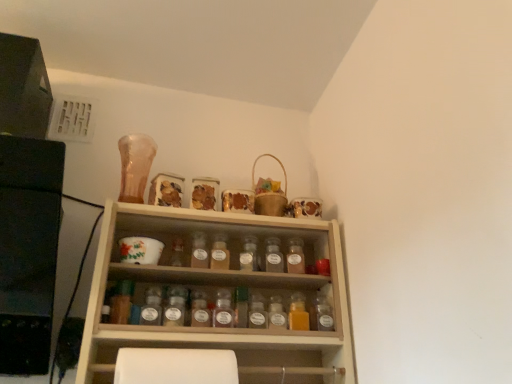
The height and width of the screenshot is (384, 512). What are the coordinates of `translucent glass spice at center, arranged as the fifth bottle when viewed from the left` in the screenshot? It's located at (223, 310).

Describe the element at coordinates (220, 253) in the screenshot. Image resolution: width=512 pixels, height=384 pixels. I see `translucent glass spice jar at center, the 4th bottle viewed from the left` at that location.

Measure the distance between translucent glass spice at center, the 6th bottle when ordered from right to left, and camera.

translucent glass spice at center, the 6th bottle when ordered from right to left, and camera are 1.22 meters apart.

Describe the element at coordinates (216, 293) in the screenshot. I see `wooden spice rack at center` at that location.

This screenshot has width=512, height=384. Describe the element at coordinates (322, 313) in the screenshot. I see `translucent amber bottle at center, which ranks as the 11th bottle in left-to-right order` at that location.

Where is `translucent glass spice at center, arranged as the fifth bottle when viewed from the left`? This screenshot has height=384, width=512. translucent glass spice at center, arranged as the fifth bottle when viewed from the left is located at coordinates (223, 310).

Consider the image. From the image's perspective, which object appears higher, translucent glass spice at center, which appears as the 3th bottle when viewed from the left, or translucent amber bottle at center, which ranks as the 11th bottle in left-to-right order?

translucent glass spice at center, which appears as the 3th bottle when viewed from the left, is shown above in the image.

From a real-world perspective, relative to translucent amber bottle at center, the first bottle from the right, is translucent glass spice at center, the ninth bottle from the right, vertically above or below?

From a real-world perspective, translucent glass spice at center, the ninth bottle from the right, is physically above translucent amber bottle at center, the first bottle from the right.

Based on the photo, is translucent glass spice at center, the ninth bottle from the right, touching translucent amber bottle at center, which ranks as the 11th bottle in left-to-right order?

No.

Can you confirm if translucent glass spice jar at center, arranged as the 3th bottle when viewed from the right, is wider than translucent glass spice jar at center, marked as the second bottle in a left-to-right arrangement?

Yes.

Considering the relative positions of translucent glass spice jar at center, the ninth bottle in the left-to-right sequence, and translucent glass spice jar at center, marked as the second bottle in a left-to-right arrangement, in the image provided, is translucent glass spice jar at center, the ninth bottle in the left-to-right sequence, to the right of translucent glass spice jar at center, marked as the second bottle in a left-to-right arrangement, from the viewer's perspective?

Indeed, translucent glass spice jar at center, the ninth bottle in the left-to-right sequence, is positioned on the right side of translucent glass spice jar at center, marked as the second bottle in a left-to-right arrangement.

How different are the orientations of translucent glass spice jar at center, the ninth bottle in the left-to-right sequence, and translucent glass spice jar at center, which ranks as the 10th bottle in right-to-left order, in degrees?

The angular difference between translucent glass spice jar at center, the ninth bottle in the left-to-right sequence, and translucent glass spice jar at center, which ranks as the 10th bottle in right-to-left order, is 0.00018 degrees.

Which is correct: translucent glass spice jar at center, arranged as the 3th bottle when viewed from the right, is inside translucent glass spice jar at center, which ranks as the 10th bottle in right-to-left order, or outside of it?

translucent glass spice jar at center, arranged as the 3th bottle when viewed from the right, lies outside translucent glass spice jar at center, which ranks as the 10th bottle in right-to-left order.

Based on the photo, considering the relative sizes of translucent amber bottle at center, which ranks as the 11th bottle in left-to-right order, and translucent plastic spice jar at center, which is the eighth bottle from left to right, in the image provided, is translucent amber bottle at center, which ranks as the 11th bottle in left-to-right order, thinner than translucent plastic spice jar at center, which is the eighth bottle from left to right,?

In fact, translucent amber bottle at center, which ranks as the 11th bottle in left-to-right order, might be wider than translucent plastic spice jar at center, which is the eighth bottle from left to right.

Is translucent amber bottle at center, the first bottle from the right, not close to translucent plastic spice jar at center, which is the eighth bottle from left to right?

translucent amber bottle at center, the first bottle from the right, is near translucent plastic spice jar at center, which is the eighth bottle from left to right, not far away.

Is translucent amber bottle at center, the first bottle from the right, at the right side of translucent plastic spice jar at center, which ranks as the 4th bottle in right-to-left order?

Indeed, translucent amber bottle at center, the first bottle from the right, is positioned on the right side of translucent plastic spice jar at center, which ranks as the 4th bottle in right-to-left order.

Where is `the 3rd bottle counting from the left side of the translucent amber bottle at center, which ranks as the 11th bottle in left-to-right order`? the 3rd bottle counting from the left side of the translucent amber bottle at center, which ranks as the 11th bottle in left-to-right order is located at coordinates (277, 313).

Are translucent glass spice at center, which appears as the 3th bottle when viewed from the left, and translucent glass spice at center, the 6th bottle when ordered from right to left, far apart?

translucent glass spice at center, which appears as the 3th bottle when viewed from the left, is near translucent glass spice at center, the 6th bottle when ordered from right to left, not far away.

How distant is translucent glass spice at center, the ninth bottle from the right, from translucent glass spice at center, the 6th bottle when ordered from right to left?

A distance of 6.97 inches exists between translucent glass spice at center, the ninth bottle from the right, and translucent glass spice at center, the 6th bottle when ordered from right to left.

Is translucent glass spice at center, which appears as the 3th bottle when viewed from the left, inside the boundaries of translucent glass spice at center, which appears as the sixth bottle when viewed from the left, or outside?

translucent glass spice at center, which appears as the 3th bottle when viewed from the left, is spatially situated outside translucent glass spice at center, which appears as the sixth bottle when viewed from the left.

Based on the photo, is translucent glass spice at center, the ninth bottle from the right, to the left of translucent glass spice at center, which appears as the sixth bottle when viewed from the left, from the viewer's perspective?

Indeed, translucent glass spice at center, the ninth bottle from the right, is positioned on the left side of translucent glass spice at center, which appears as the sixth bottle when viewed from the left.

Locate an element on the screen. the 2nd bottle to the left when counting from the translucent glass spice jar at center, arranged as the 3th bottle when viewed from the right is located at coordinates (273, 256).

Considering the sizes of objects translucent glass spice jar at center, which is counted as the 7th bottle, starting from the left, and translucent glass spice jar at center, the ninth bottle in the left-to-right sequence, in the image provided, who is smaller, translucent glass spice jar at center, which is counted as the 7th bottle, starting from the left, or translucent glass spice jar at center, the ninth bottle in the left-to-right sequence,?

With smaller size is translucent glass spice jar at center, the ninth bottle in the left-to-right sequence.

Does point (279, 254) lie behind point (289, 248)?

No.

Is translucent glass spice jar at center, which is counted as the 7th bottle, starting from the left, beside translucent glass spice jar at center, the ninth bottle in the left-to-right sequence?

Yes, translucent glass spice jar at center, which is counted as the 7th bottle, starting from the left, is in contact with translucent glass spice jar at center, the ninth bottle in the left-to-right sequence.

Is translucent glass spice at center, the 6th bottle when ordered from right to left, further to the viewer compared to wooden spice rack at center?

Yes, it is.

From their relative heights in the image, would you say translucent glass spice at center, which appears as the sixth bottle when viewed from the left, is taller or shorter than wooden spice rack at center?

In the image, translucent glass spice at center, which appears as the sixth bottle when viewed from the left, appears to be shorter than wooden spice rack at center.

In the scene shown: Is translucent glass spice at center, which appears as the sixth bottle when viewed from the left, oriented away from wooden spice rack at center?

Yes, translucent glass spice at center, which appears as the sixth bottle when viewed from the left, is facing away from wooden spice rack at center.

Does translucent glass spice at center, the 6th bottle when ordered from right to left, have a larger size compared to wooden spice rack at center?

No.

Is wooden spice rack at center to the right of translucent glass bottle at center, the 1th bottle when ordered from left to right, from the viewer's perspective?

Correct, you'll find wooden spice rack at center to the right of translucent glass bottle at center, the 1th bottle when ordered from left to right.

Is wooden spice rack at center positioned far away from translucent glass bottle at center, the 1th bottle when ordered from left to right?

wooden spice rack at center is near translucent glass bottle at center, the 1th bottle when ordered from left to right, not far away.

From the image's perspective, is wooden spice rack at center over translucent glass bottle at center, the 1th bottle when ordered from left to right?

No, from the image's perspective, wooden spice rack at center is not on top of translucent glass bottle at center, the 1th bottle when ordered from left to right.

Locate an element on the screen. The width and height of the screenshot is (512, 384). the 1st bottle located beneath the translucent glass spice at center, the ninth bottle from the right (from a real-world perspective) is located at coordinates [322, 313].

From the translucent glass spice jar at center, arranged as the 3th bottle when viewed from the right, count 3rd bottles forward and point to it. Please provide its 2D coordinates.

[(199, 251)]

From the picture: Based on their spatial positions, is translucent glass spice at center, the 6th bottle when ordered from right to left, or translucent glass spice jar at center, which appears as the 5th bottle when viewed from the right, closer to translucent glass spice jar at center, the eighth bottle viewed from the right?

translucent glass spice at center, the 6th bottle when ordered from right to left, lies closer to translucent glass spice jar at center, the eighth bottle viewed from the right, than the other object.

Based on their spatial positions, is wooden spice rack at center or translucent glass bottle at center, the 11th bottle when ordered from right to left, further from translucent glass spice at center, which appears as the sixth bottle when viewed from the left?

The object further to translucent glass spice at center, which appears as the sixth bottle when viewed from the left, is translucent glass bottle at center, the 11th bottle when ordered from right to left.

Considering their positions, is translucent glass spice at center, arranged as the fifth bottle when viewed from the left, positioned further to translucent glass spice jar at center, which ranks as the 10th bottle in right-to-left order, than translucent amber bottle at center, which ranks as the 11th bottle in left-to-right order?

translucent amber bottle at center, which ranks as the 11th bottle in left-to-right order.

Considering their positions, is translucent glass spice jar at center, which is counted as the 7th bottle, starting from the left, positioned further to translucent plastic spice jar at center, which ranks as the 4th bottle in right-to-left order, than translucent amber glass spice jar at center, which appears as the second bottle when viewed from the right?

Based on the image, translucent glass spice jar at center, which is counted as the 7th bottle, starting from the left, appears to be further to translucent plastic spice jar at center, which ranks as the 4th bottle in right-to-left order.

Looking at the image, which one is located closer to translucent glass spice jar at center, the 4th bottle viewed from the left, translucent glass spice at center, which appears as the sixth bottle when viewed from the left, or translucent glass spice jar at center, the ninth bottle in the left-to-right sequence?

translucent glass spice at center, which appears as the sixth bottle when viewed from the left, is closer to translucent glass spice jar at center, the 4th bottle viewed from the left.

Estimate the real-world distances between objects in this image. Which object is further from translucent glass bottle at center, the 11th bottle when ordered from right to left, translucent glass spice at center, the 6th bottle when ordered from right to left, or translucent glass spice jar at center, which ranks as the 10th bottle in right-to-left order?

translucent glass spice at center, the 6th bottle when ordered from right to left, lies further to translucent glass bottle at center, the 11th bottle when ordered from right to left, than the other object.

When comparing their distances from translucent glass spice at center, which appears as the sixth bottle when viewed from the left, does translucent glass spice at center, the ninth bottle from the right, or translucent amber bottle at center, which ranks as the 11th bottle in left-to-right order, seem further?

The object further to translucent glass spice at center, which appears as the sixth bottle when viewed from the left, is translucent amber bottle at center, which ranks as the 11th bottle in left-to-right order.

Estimate the real-world distances between objects in this image. Which object is closer to translucent glass bottle at center, the 11th bottle when ordered from right to left, translucent amber bottle at center, which ranks as the 11th bottle in left-to-right order, or translucent glass spice at center, marked as the seventh bottle in a right-to-left arrangement?

translucent glass spice at center, marked as the seventh bottle in a right-to-left arrangement, lies closer to translucent glass bottle at center, the 11th bottle when ordered from right to left, than the other object.

At what (x,y) coordinates should I click in order to perform the action: click on shelf situated between translucent glass spice jar at center, marked as the second bottle in a left-to-right arrangement, and translucent amber bottle at center, the first bottle from the right, from left to right. Please return your answer as a coordinate pair (x, y). The width and height of the screenshot is (512, 384). Looking at the image, I should click on [216, 293].

This screenshot has width=512, height=384. I want to click on shelf between translucent glass bottle at center, the 1th bottle when ordered from left to right, and translucent glass spice jar at center, the ninth bottle in the left-to-right sequence, in the horizontal direction, so click(x=216, y=293).

This screenshot has width=512, height=384. Identify the location of shelf between translucent glass bottle at center, the 11th bottle when ordered from right to left, and translucent amber bottle at center, the first bottle from the right, from left to right. (216, 293).

Where is `shelf located between translucent glass spice at center, the ninth bottle from the right, and translucent amber glass spice jar at center, which appears as the second bottle when viewed from the right, in the left-right direction`? shelf located between translucent glass spice at center, the ninth bottle from the right, and translucent amber glass spice jar at center, which appears as the second bottle when viewed from the right, in the left-right direction is located at coordinates (216, 293).